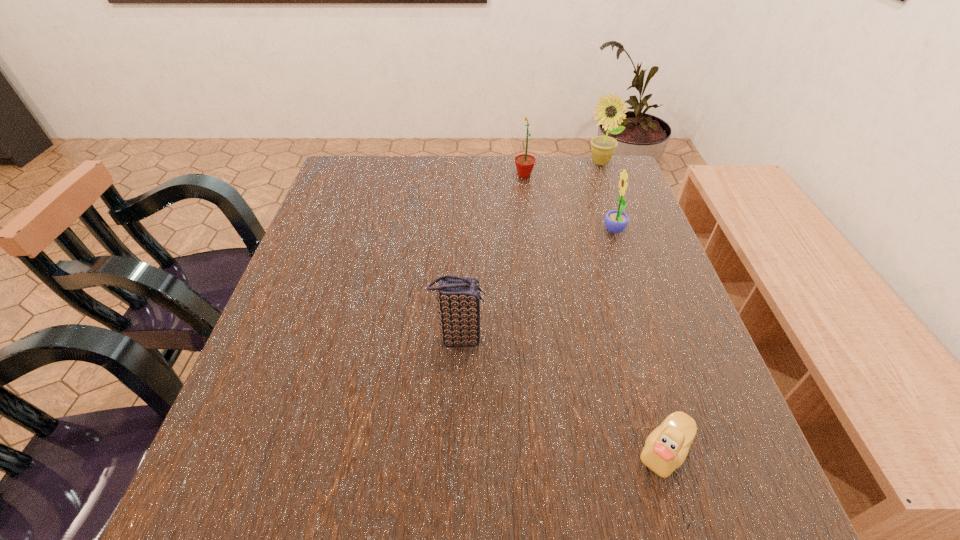
Select which object is the third closest to the third farthest object. Please provide its 2D coordinates. Your answer should be formatted as a tuple, i.e. [(x, y)], where the tuple contains the x and y coordinates of a point satisfying the conditions above.

[(458, 299)]

At what (x,y) coordinates should I click in order to perform the action: click on the fourth closest object to the shortest object. Please return your answer as a coordinate pair (x, y). The width and height of the screenshot is (960, 540). Looking at the image, I should click on (603, 147).

Select which sunflower is the closest to the nearest sunflower. Please provide its 2D coordinates. Your answer should be formatted as a tuple, i.e. [(x, y)], where the tuple contains the x and y coordinates of a point satisfying the conditions above.

[(524, 163)]

Locate an element on the screen. The image size is (960, 540). sunflower identified as the closest to the second nearest object is located at coordinates (616, 221).